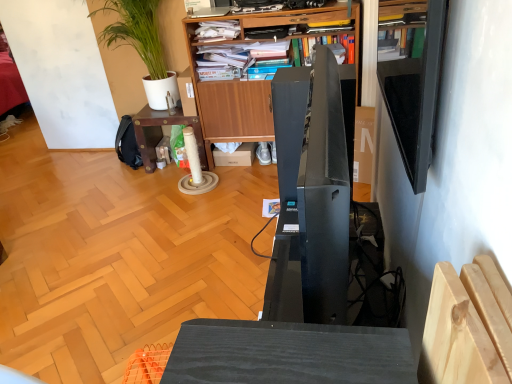
I want to click on blank space to the left of wooden table at center, so click(121, 182).